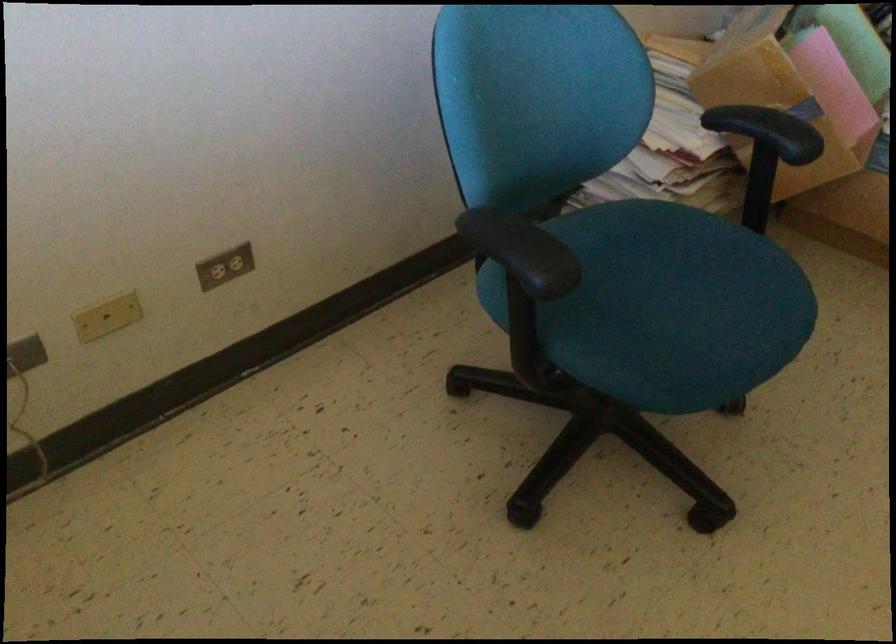
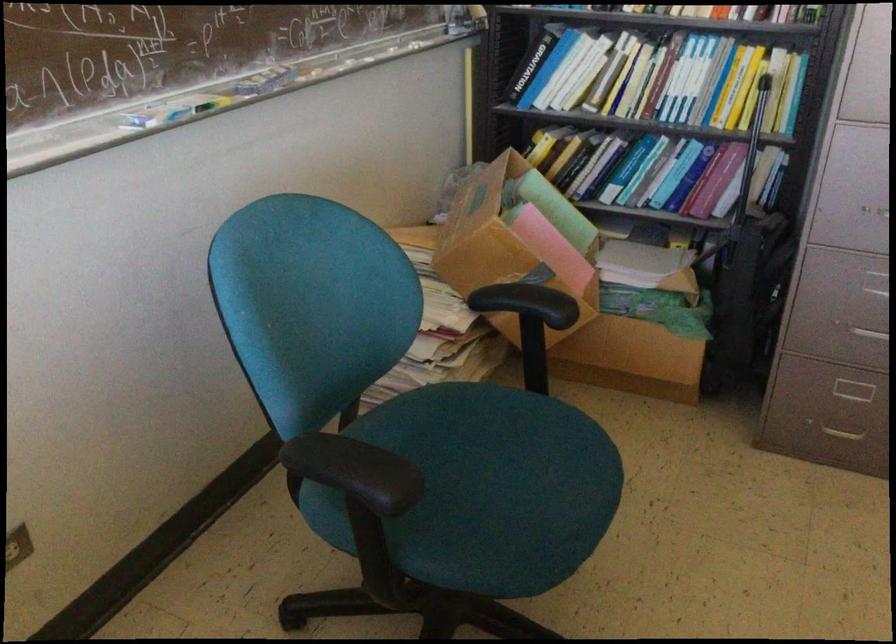
Question: The camera is either moving clockwise (left) or counter-clockwise (right) around the object. The first image is from the beginning of the video and the second image is from the end. Is the camera moving left or right when shooting the video?

Choices:
 (A) Left
 (B) Right

Answer: (A)